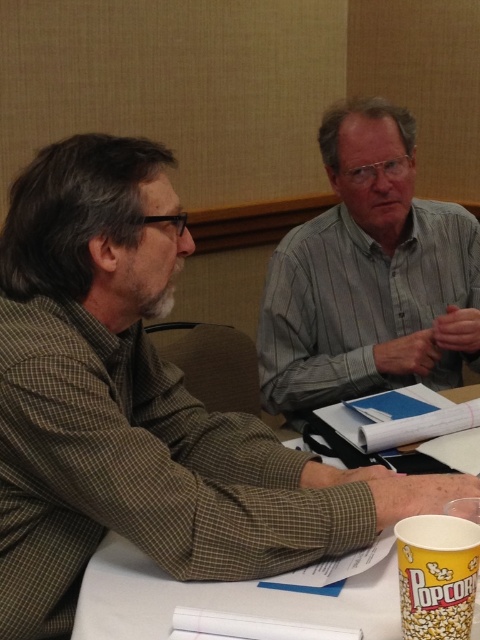
You are a photographer setting up for a group photo. You need to position a camera so that both the gray striped shirt at upper right and the white paper at center are in frame. Considering their heights, which object should be placed closer to the camera to ensure both are fully visible?

The gray striped shirt at upper right is taller than the white paper at center, so to ensure both are fully visible, the white paper at center should be placed closer to the camera.

You are organizing a presentation and need to place a 12x12 inch square object on the table between the gray striped shirt at upper right and the white paper at center. Can the object fit between them without overlapping either?

The gray striped shirt at upper right is bigger than the white paper at center. Since the object is 12x12 inches, it depends on the available space between them. However, without specific distance information, we cannot confirm if it will fit. Please check the actual spacing.